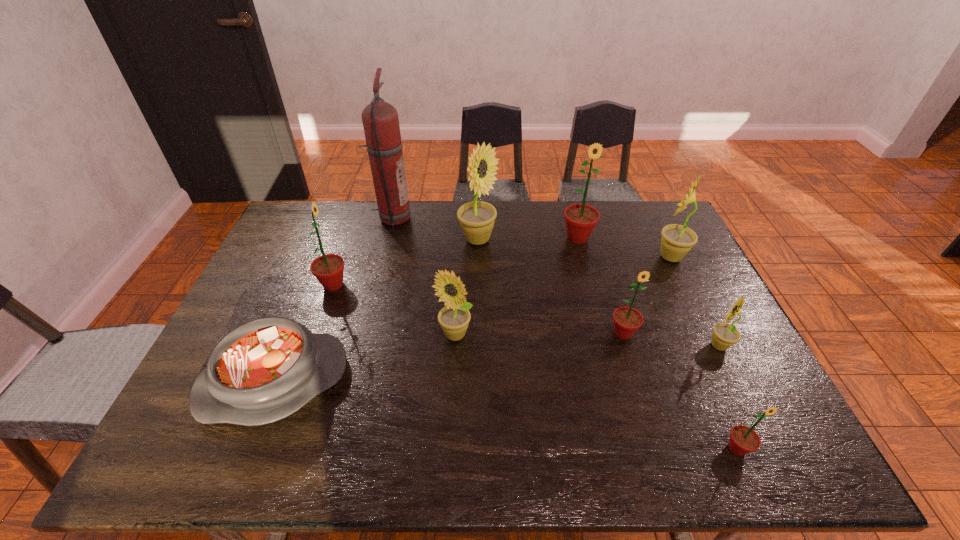
Locate an element on the screen. free spot between the red fire extinguisher and the shortest object is located at coordinates (333, 300).

At what (x,y) coordinates should I click in order to perform the action: click on free space between the smallest yellow sunflower and the biggest yellow sunflower. Please return your answer as a coordinate pair (x, y). Looking at the image, I should click on (598, 293).

You are a GUI agent. You are given a task and a screenshot of the screen. Output one action in this format:
    pyautogui.click(x=<x>, y=<y>)
    Task: Click on the vacant area that lies between the smallest yellow sunflower and the third biggest yellow sunflower
    The height and width of the screenshot is (540, 960).
    Given the screenshot: What is the action you would take?
    pyautogui.click(x=587, y=340)

You are a GUI agent. You are given a task and a screenshot of the screen. Output one action in this format:
    pyautogui.click(x=<x>, y=<y>)
    Task: Click on the unoccupied area between the farthest green sunflower and the casserole
    
    Given the screenshot: What is the action you would take?
    pyautogui.click(x=426, y=309)

You are a GUI agent. You are given a task and a screenshot of the screen. Output one action in this format:
    pyautogui.click(x=<x>, y=<y>)
    Task: Click on the empty location between the biggest green sunflower and the smallest yellow sunflower
    
    Given the screenshot: What is the action you would take?
    pyautogui.click(x=648, y=292)

Find the location of a particular element. empty space between the biggest green sunflower and the third farthest green sunflower is located at coordinates tap(600, 286).

At what (x,y) coordinates should I click in order to perform the action: click on free area in between the second nearest green sunflower and the third smallest yellow sunflower. Please return your answer as a coordinate pair (x, y). This screenshot has height=540, width=960. Looking at the image, I should click on (647, 295).

Identify which object is the ninth closest to the third smallest yellow sunflower. Please provide its 2D coordinates. Your answer should be formatted as a tuple, i.e. [(x, y)], where the tuple contains the x and y coordinates of a point satisfying the conditions above.

[(328, 269)]

I want to click on the seventh closest object to the smallest yellow sunflower, so click(264, 370).

Where is `sunflower that is the seventh closest one to the smallest yellow sunflower`? Image resolution: width=960 pixels, height=540 pixels. sunflower that is the seventh closest one to the smallest yellow sunflower is located at coordinates (328, 269).